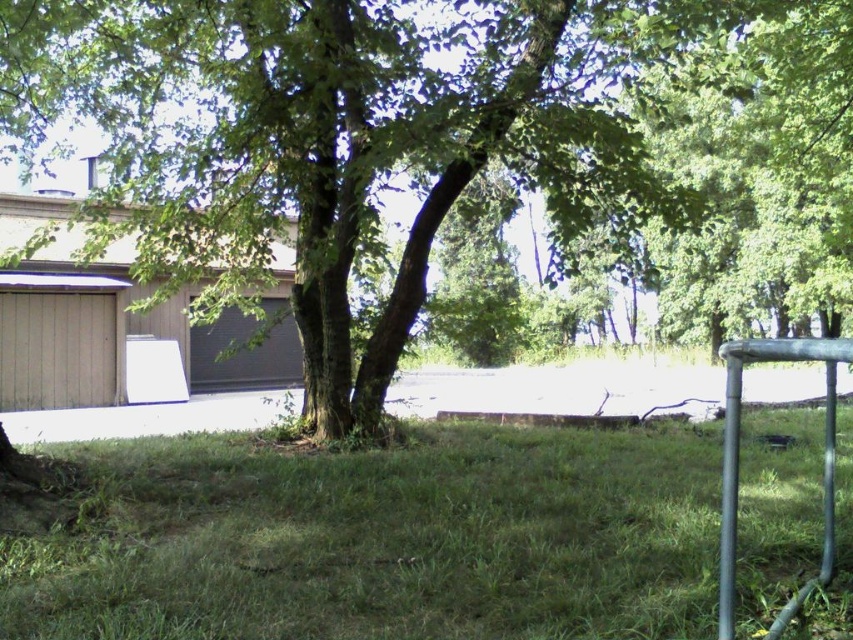
Question: Is the position of green leafy tree at center less distant than that of metallic silver rail at lower right?

Choices:
 (A) yes
 (B) no

Answer: (B)

Question: Which point is farther to the camera?

Choices:
 (A) (720, 634)
 (B) (338, 392)
 (C) (773, 532)

Answer: (B)

Question: Is green grassy at center to the right of metallic silver rail at lower right from the viewer's perspective?

Choices:
 (A) yes
 (B) no

Answer: (B)

Question: Which point is farther to the camera?

Choices:
 (A) metallic silver rail at lower right
 (B) green leafy tree at center
 (C) green grassy at center

Answer: (B)

Question: Based on their relative distances, which object is nearer to the green grassy at center?

Choices:
 (A) green leafy tree at center
 (B) metallic silver rail at lower right

Answer: (B)

Question: Does green grassy at center lie in front of metallic silver rail at lower right?

Choices:
 (A) no
 (B) yes

Answer: (A)